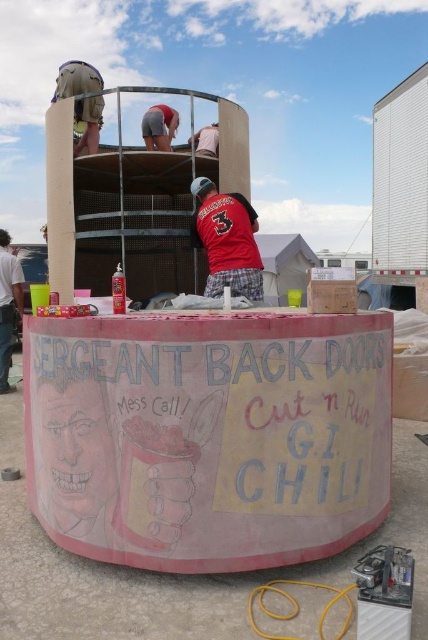
You are standing at the point with coordinates point (74, 108) and want to walk towards the point with coordinates point (240, 344). Given the scene, will you have to move forward or backward to reach your destination?

You will have to move forward to reach point (240, 344) because it is in front of point (74, 108) according to the spatial description.

You are standing in front of the pink chalkboard sign at center and the brushed metal helmet at upper left. Which object is positioned higher up in the image?

The brushed metal helmet at upper left is positioned higher up because the pink chalkboard sign at center is located below it.